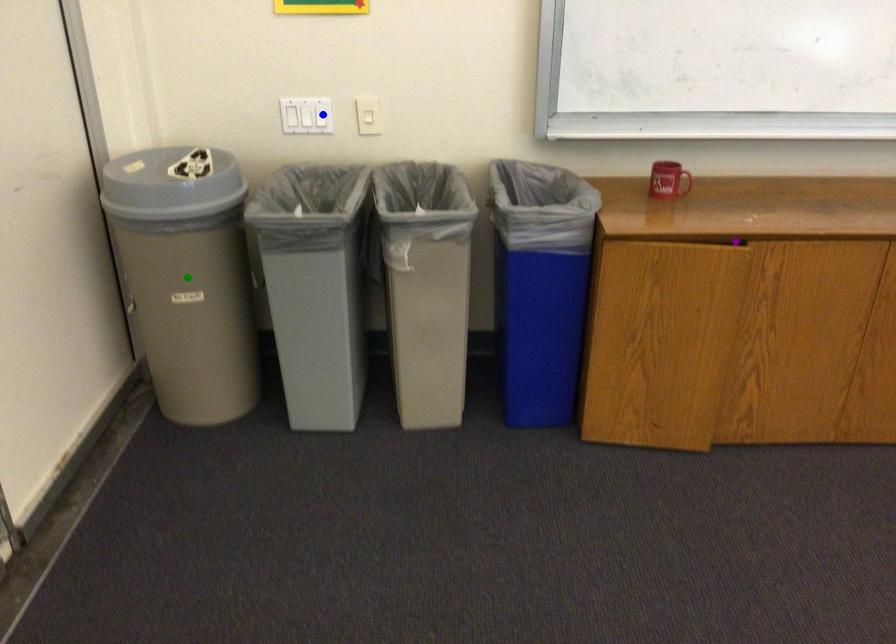
Order these from nearest to farthest:
A) purple point
B) green point
C) blue point

purple point, green point, blue point